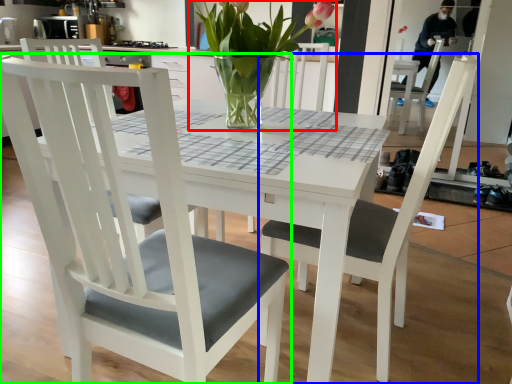
Question: Estimate the real-world distances between objects in this image. Which object is closer to houseplant (highlighted by a red box), chair (highlighted by a blue box) or chair (highlighted by a green box)?

Choices:
 (A) chair
 (B) chair

Answer: (A)